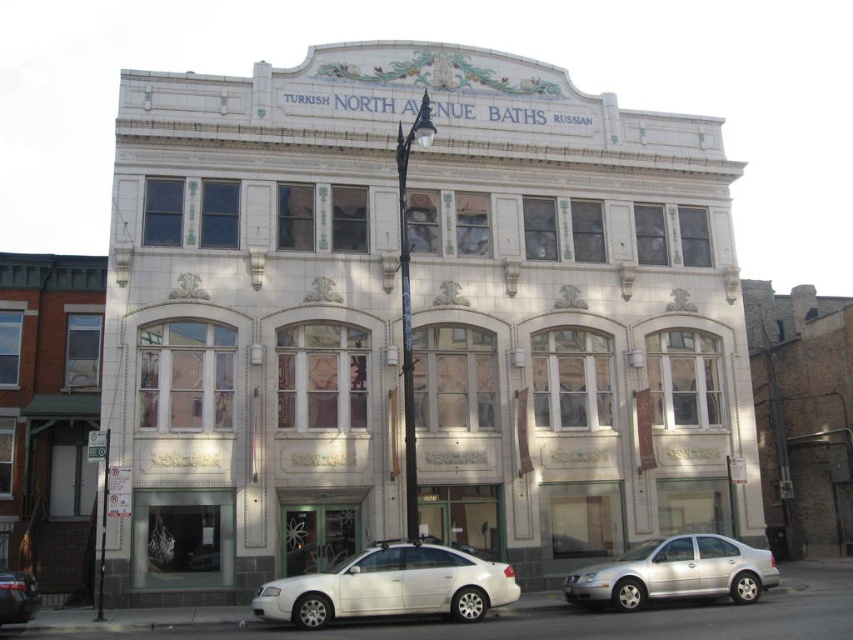
You are a delivery driver who needs to park your truck, which is 6 meters long, between the white matte sedan at lower center and the white glossy sedan at lower left. Can you fit your truck in that space?

The white matte sedan at lower center is larger than the white glossy sedan at lower left, but the exact distance between them isn not provided. Without knowing the space between the two sedans, it is impossible to determine if the truck can fit.

You are standing at the entrance of the Turkish North Avenue Baths Russian building and want to park your white matte sedan at lower center. The parking spot is located at coordinate point (390,586). Is your car already parked in the correct spot?

Yes, the white matte sedan at lower center is already parked at coordinate point (390,586).